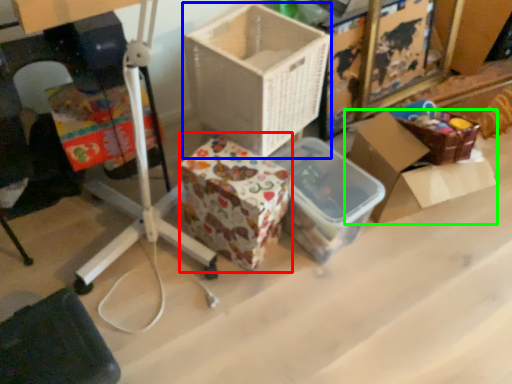
Question: Which object is the closest to the storage box (highlighted by a red box)? Choose among these: box (highlighted by a blue box) or box (highlighted by a green box).

Choices:
 (A) box
 (B) box

Answer: (A)